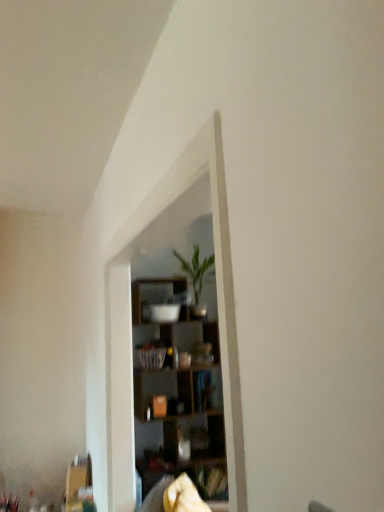
Question: Is green leafy plant at center inside the boundaries of wooden shelves at center, or outside?

Choices:
 (A) outside
 (B) inside

Answer: (B)

Question: From the image's perspective, is green leafy plant at center above or below wooden shelves at center?

Choices:
 (A) above
 (B) below

Answer: (A)

Question: From a real-world perspective, is green leafy plant at center positioned above or below wooden shelves at center?

Choices:
 (A) above
 (B) below

Answer: (A)

Question: Relative to green leafy plant at center, is wooden shelves at center in front or behind?

Choices:
 (A) behind
 (B) front

Answer: (B)

Question: Does point (223, 480) appear closer or farther from the camera than point (173, 251)?

Choices:
 (A) closer
 (B) farther

Answer: (A)

Question: From a real-world perspective, is wooden shelves at center positioned above or below green leafy plant at center?

Choices:
 (A) above
 (B) below

Answer: (B)

Question: From the image's perspective, is wooden shelves at center located above or below green leafy plant at center?

Choices:
 (A) below
 (B) above

Answer: (A)